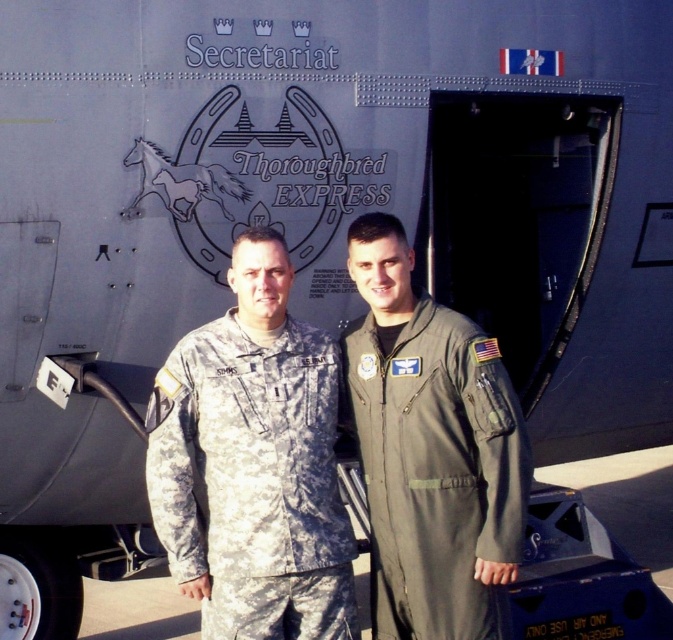
Question: Is camouflage fabric uniform at center thinner than olive green fabric flight suit at center?

Choices:
 (A) yes
 (B) no

Answer: (B)

Question: Among these objects, which one is nearest to the camera?

Choices:
 (A) olive green fabric flight suit at center
 (B) camouflage fabric uniform at center

Answer: (A)

Question: Observing the image, what is the correct spatial positioning of camouflage fabric uniform at center in reference to olive green fabric flight suit at center?

Choices:
 (A) above
 (B) below

Answer: (B)

Question: Observing the image, what is the correct spatial positioning of camouflage fabric uniform at center in reference to olive green fabric flight suit at center?

Choices:
 (A) left
 (B) right

Answer: (A)